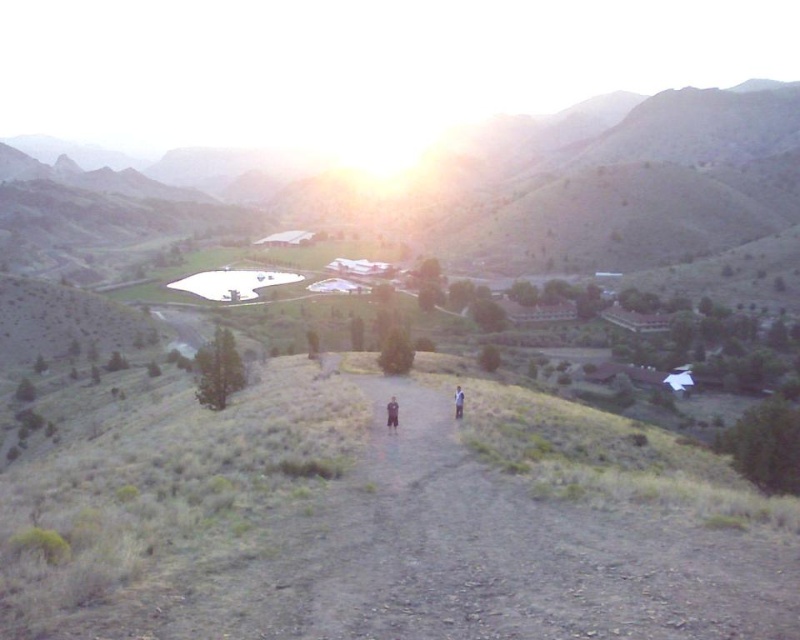
Question: Can you confirm if dark blue jeans at center is smaller than light brown fabric shirt at center?

Choices:
 (A) no
 (B) yes

Answer: (B)

Question: Which point is farther to the camera?

Choices:
 (A) light brown fabric shirt at center
 (B) dark blue jeans at center

Answer: (A)

Question: Can you confirm if dark blue jeans at center is wider than light brown fabric shirt at center?

Choices:
 (A) yes
 (B) no

Answer: (B)

Question: Where is dark blue jeans at center located in relation to light brown fabric shirt at center in the image?

Choices:
 (A) left
 (B) right

Answer: (A)